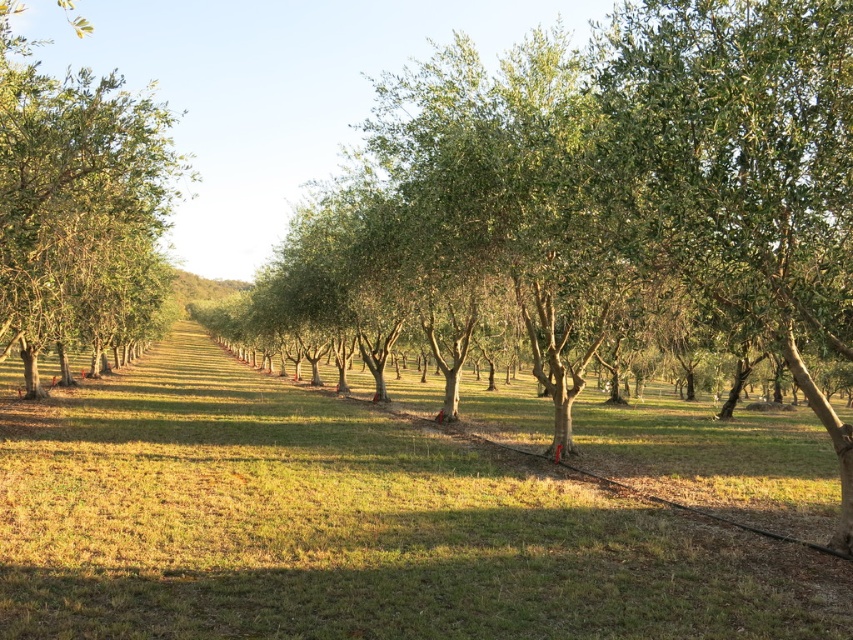
Question: From the image, what is the correct spatial relationship of green leafy tree at center in relation to green leafy tree at left?

Choices:
 (A) left
 (B) right

Answer: (B)

Question: Is green grass at center to the right of green leafy tree at center from the viewer's perspective?

Choices:
 (A) yes
 (B) no

Answer: (B)

Question: Among these points, which one is nearest to the camera?

Choices:
 (A) [x=457, y=129]
 (B) [x=398, y=598]

Answer: (B)

Question: Is green grass at center in front of green leafy tree at center?

Choices:
 (A) no
 (B) yes

Answer: (B)

Question: Which point is farther to the camera?

Choices:
 (A) (318, 456)
 (B) (723, 3)
 (C) (26, 145)

Answer: (A)

Question: Which object appears closest to the camera in this image?

Choices:
 (A) green leafy tree at left
 (B) green grass at center
 (C) green leafy tree at center

Answer: (B)